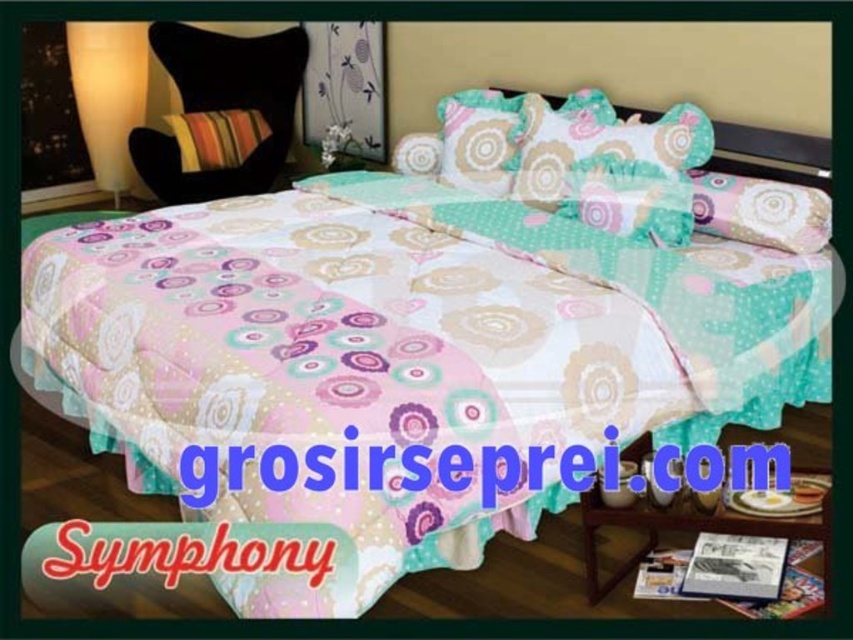
From the picture: Can you confirm if pastel floral pillow at center is taller than striped fabric pillow at upper left?

No, pastel floral pillow at center is not taller than striped fabric pillow at upper left.

Who is positioned more to the left, pastel floral pillow at center or striped fabric pillow at upper left?

From the viewer's perspective, striped fabric pillow at upper left appears more on the left side.

Locate an element on the screen. pastel floral pillow at center is located at coordinates (630, 198).

Does white frosted glass lamp at upper left have a smaller size compared to pink fabric pillow at upper right?

Actually, white frosted glass lamp at upper left might be larger than pink fabric pillow at upper right.

Is white frosted glass lamp at upper left above pink fabric pillow at upper right?

Yes, white frosted glass lamp at upper left is above pink fabric pillow at upper right.

Who is more distant from viewer, (79, 93) or (805, 189)?

Positioned behind is point (79, 93).

Where is `white frosted glass lamp at upper left`? Image resolution: width=853 pixels, height=640 pixels. white frosted glass lamp at upper left is located at coordinates (109, 96).

Is point (96, 145) farther from camera compared to point (204, 145)?

That is True.

Does point (97, 35) come in front of point (202, 163)?

No, (97, 35) is further to viewer.

Identify the location of white frosted glass lamp at upper left. (109, 96).